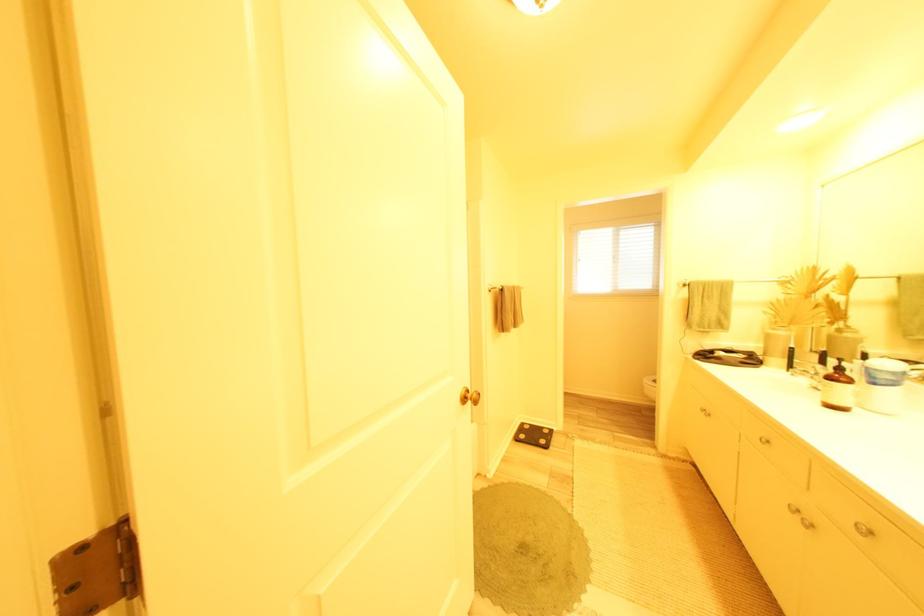
Find where to lift the black floor scale. Please return your answer as a coordinate pair (x, y).

(533, 435)